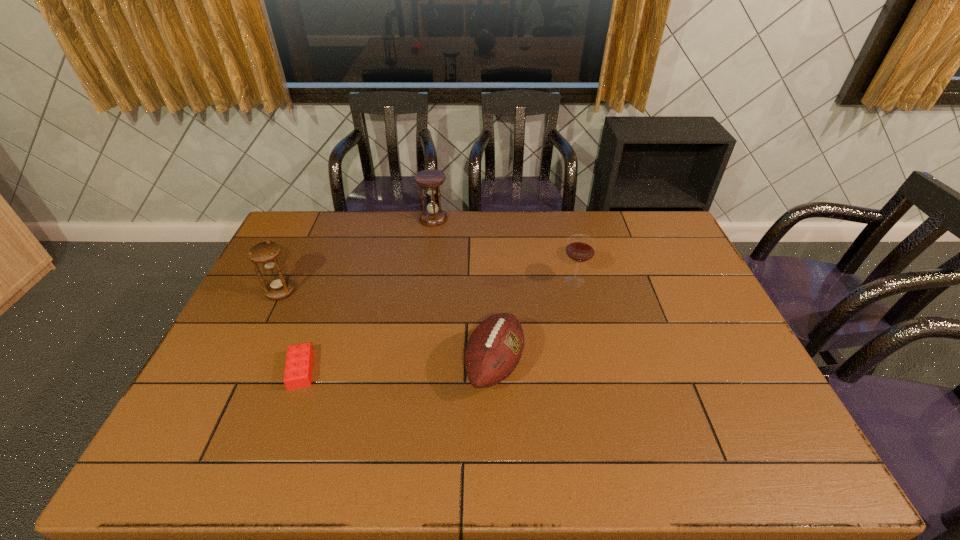
This screenshot has height=540, width=960. I want to click on the farther hourglass, so click(433, 216).

Locate an element on the screen. The image size is (960, 540). the farthest object is located at coordinates (433, 216).

The width and height of the screenshot is (960, 540). I want to click on the left hourglass, so click(265, 253).

At what (x,y) coordinates should I click in order to perform the action: click on the leftmost object. Please return your answer as a coordinate pair (x, y). This screenshot has height=540, width=960. Looking at the image, I should click on (265, 253).

Where is `wineglass`? The width and height of the screenshot is (960, 540). wineglass is located at coordinates (580, 248).

Find the location of a particular element. This screenshot has width=960, height=540. football (American) is located at coordinates (494, 349).

Locate an element on the screen. This screenshot has width=960, height=540. Lego is located at coordinates (299, 362).

Where is `the shortest object`? The image size is (960, 540). the shortest object is located at coordinates (299, 362).

The width and height of the screenshot is (960, 540). Find the location of `vacant region located on the left of the farther hourglass`. vacant region located on the left of the farther hourglass is located at coordinates (373, 219).

Locate an element on the screen. blank space located 0.130m on the back of the leftmost object is located at coordinates (298, 257).